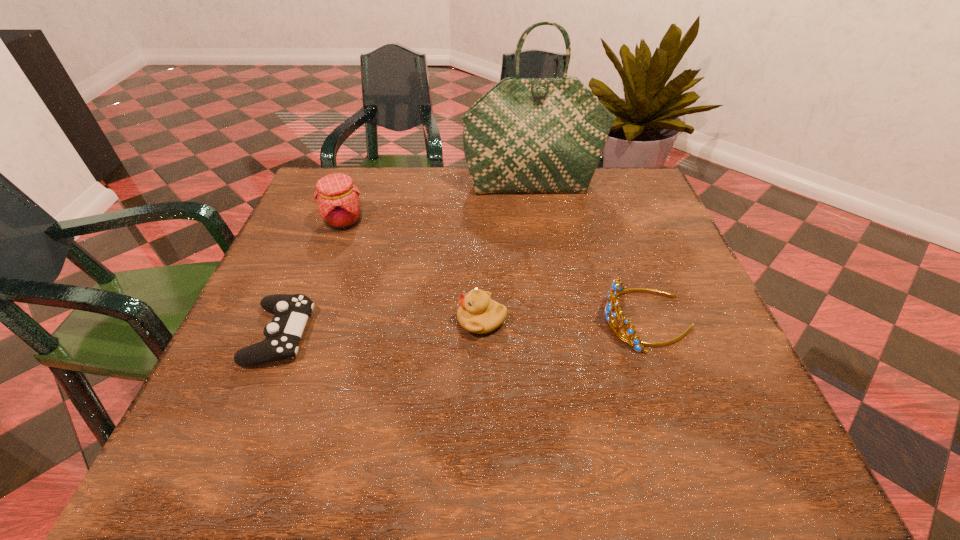
This screenshot has height=540, width=960. I want to click on tiara positioned at the right edge, so click(x=617, y=288).

The height and width of the screenshot is (540, 960). What are the coordinates of `object that is at the far left corner` in the screenshot? It's located at (337, 197).

You are a GUI agent. You are given a task and a screenshot of the screen. Output one action in this format:
    pyautogui.click(x=<x>, y=<y>)
    Task: Click on the object present at the far right corner
    The height and width of the screenshot is (540, 960).
    Given the screenshot: What is the action you would take?
    coord(525,135)

Image resolution: width=960 pixels, height=540 pixels. Identify the location of vacant space at the far edge of the desktop. (449, 209).

Locate an element on the screen. This screenshot has height=540, width=960. free space at the near edge of the desktop is located at coordinates (291, 435).

What are the coordinates of `free space at the left edge of the desktop` in the screenshot? It's located at (324, 321).

Where is `free location at the right edge of the desktop`? The image size is (960, 540). free location at the right edge of the desktop is located at coordinates (726, 384).

Locate an element on the screen. vacant space at the far left corner is located at coordinates (352, 167).

In the image, there is a desktop. Identify the location of blank space at the far right corner. This screenshot has width=960, height=540. (634, 173).

Identify the location of vacant area between the fourth tallest object and the tiara. (564, 320).